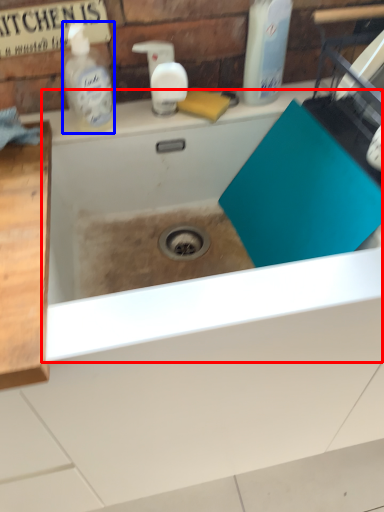
Question: Which point is further to the camera, bath (highlighted by a red box) or cleaning product (highlighted by a blue box)?

Choices:
 (A) bath
 (B) cleaning product

Answer: (B)